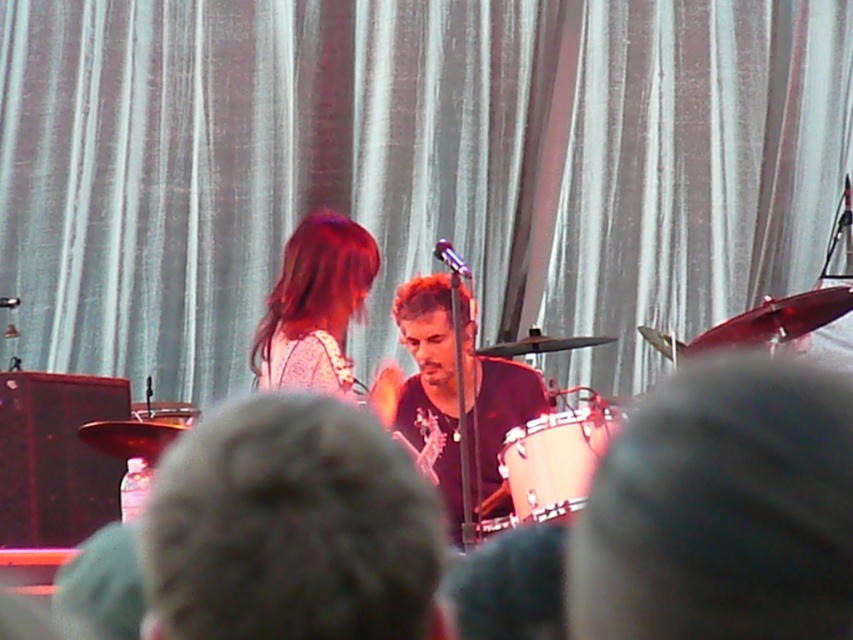
Question: Which point is farther to the camera?

Choices:
 (A) (473, 67)
 (B) (566, 509)
 (C) (289, 381)

Answer: (A)

Question: Does black matte shirt at center have a smaller size compared to matte white dress at center?

Choices:
 (A) yes
 (B) no

Answer: (B)

Question: Which point is farther from the camera taking this photo?

Choices:
 (A) (323, 300)
 (B) (213, 61)

Answer: (B)

Question: Is black matte shirt at center thinner than matte white dress at center?

Choices:
 (A) yes
 (B) no

Answer: (B)

Question: Based on their relative distances, which object is farther from the matte silver drum at center?

Choices:
 (A) black matte shirt at center
 (B) white fabric curtain at upper center
 (C) matte white dress at center

Answer: (B)

Question: Does black matte shirt at center have a greater width compared to matte white dress at center?

Choices:
 (A) yes
 (B) no

Answer: (A)